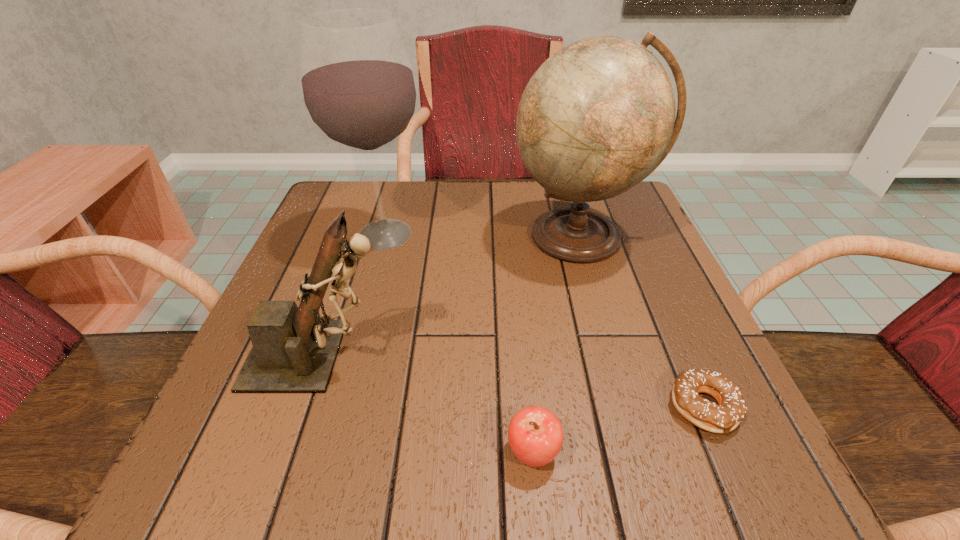
You are a GUI agent. You are given a task and a screenshot of the screen. Output one action in this format:
    pyautogui.click(x=<x>, y=<y>)
    Task: Click on the object at the near right corner
    This screenshot has width=960, height=540.
    Given the screenshot: What is the action you would take?
    pyautogui.click(x=725, y=417)

Identify the location of free space at the far edge of the desktop. The height and width of the screenshot is (540, 960). (392, 209).

In the image, there is a desktop. Identify the location of free region at the near edge. (404, 465).

In the image, there is a desktop. In order to click on vacant space at the left edge in this screenshot , I will do `click(310, 399)`.

The height and width of the screenshot is (540, 960). I want to click on free space at the right edge of the desktop, so click(x=655, y=252).

In the image, there is a desktop. Identify the location of vacant space at the far left corner. The height and width of the screenshot is (540, 960). (372, 204).

The image size is (960, 540). In the image, there is a desktop. What are the coordinates of `free region at the far right corner` in the screenshot? It's located at (625, 194).

Where is `vacant space at the near right corner of the desktop`? vacant space at the near right corner of the desktop is located at coordinates (708, 446).

Where is `free point between the shortest object and the alcohol`? The image size is (960, 540). free point between the shortest object and the alcohol is located at coordinates (544, 321).

You are a GUI agent. You are given a task and a screenshot of the screen. Output one action in this format:
    pyautogui.click(x=<x>, y=<y>)
    Task: Click on the free space between the third tallest object and the doughnut
    This screenshot has height=540, width=960.
    Given the screenshot: What is the action you would take?
    pyautogui.click(x=513, y=381)